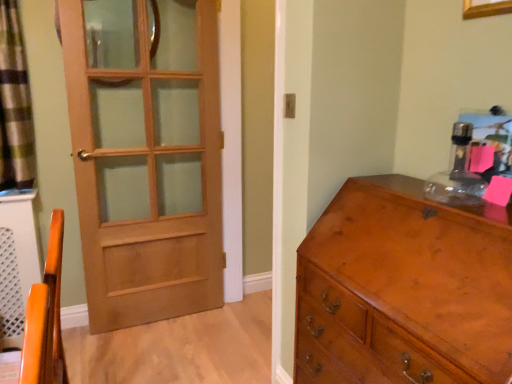
Question: From a real-world perspective, is green plaid curtain at left positioned under light brown wood door at left based on gravity?

Choices:
 (A) no
 (B) yes

Answer: (A)

Question: Does green plaid curtain at left have a lesser width compared to light brown wood door at left?

Choices:
 (A) no
 (B) yes

Answer: (A)

Question: Does green plaid curtain at left appear on the left side of light brown wood door at left?

Choices:
 (A) no
 (B) yes

Answer: (B)

Question: Considering the relative positions of green plaid curtain at left and light brown wood door at left in the image provided, is green plaid curtain at left behind light brown wood door at left?

Choices:
 (A) yes
 (B) no

Answer: (B)

Question: Is green plaid curtain at left smaller than light brown wood door at left?

Choices:
 (A) no
 (B) yes

Answer: (B)

Question: Does green plaid curtain at left lie in front of light brown wood door at left?

Choices:
 (A) yes
 (B) no

Answer: (A)

Question: Considering the relative positions of green plaid curtain at left and shiny brown wooden chest of drawers at right in the image provided, is green plaid curtain at left to the left of shiny brown wooden chest of drawers at right from the viewer's perspective?

Choices:
 (A) no
 (B) yes

Answer: (B)

Question: Is green plaid curtain at left oriented towards shiny brown wooden chest of drawers at right?

Choices:
 (A) no
 (B) yes

Answer: (A)

Question: Can you confirm if green plaid curtain at left is bigger than shiny brown wooden chest of drawers at right?

Choices:
 (A) yes
 (B) no

Answer: (B)

Question: Would you say green plaid curtain at left is outside shiny brown wooden chest of drawers at right?

Choices:
 (A) yes
 (B) no

Answer: (A)

Question: Is green plaid curtain at left wider than shiny brown wooden chest of drawers at right?

Choices:
 (A) no
 (B) yes

Answer: (A)

Question: Is the depth of green plaid curtain at left greater than that of shiny brown wooden chest of drawers at right?

Choices:
 (A) no
 (B) yes

Answer: (B)

Question: Does shiny brown wooden chest of drawers at right have a greater height compared to green plaid curtain at left?

Choices:
 (A) yes
 (B) no

Answer: (A)